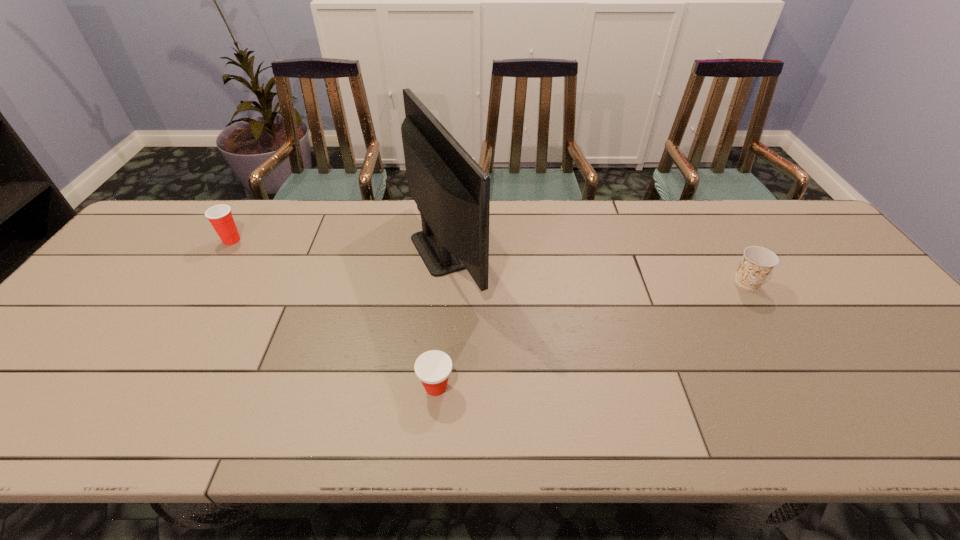
Where is `vacant space that satisfies the following two spatial constraints: 1. on the front-facing side of the computer monitor; 2. on the right side of the shortest Dixie cup`? The image size is (960, 540). vacant space that satisfies the following two spatial constraints: 1. on the front-facing side of the computer monitor; 2. on the right side of the shortest Dixie cup is located at coordinates (436, 387).

Where is `free space that satisfies the following two spatial constraints: 1. on the front-facing side of the computer monitor; 2. on the right side of the shortest Dixie cup`? The height and width of the screenshot is (540, 960). free space that satisfies the following two spatial constraints: 1. on the front-facing side of the computer monitor; 2. on the right side of the shortest Dixie cup is located at coordinates (436, 387).

Identify the location of vacant region that satisfies the following two spatial constraints: 1. on the front-facing side of the second farthest Dixie cup; 2. on the left side of the tallest object. Image resolution: width=960 pixels, height=540 pixels. (444, 283).

Find the location of a particular element. The height and width of the screenshot is (540, 960). vacant space that satisfies the following two spatial constraints: 1. on the front-facing side of the tallest object; 2. on the back side of the shortest Dixie cup is located at coordinates (436, 387).

You are a GUI agent. You are given a task and a screenshot of the screen. Output one action in this format:
    pyautogui.click(x=<x>, y=<y>)
    Task: Click on the vacant position in the image that satisfies the following two spatial constraints: 1. on the back side of the shortest Dixie cup; 2. on the right side of the second farthest Dixie cup
    Image resolution: width=960 pixels, height=540 pixels.
    Given the screenshot: What is the action you would take?
    pyautogui.click(x=444, y=283)

Find the location of a particular element. Image resolution: width=960 pixels, height=540 pixels. vacant area in the image that satisfies the following two spatial constraints: 1. on the front side of the leftmost object; 2. on the right side of the rightmost object is located at coordinates (204, 283).

Identify the location of vacant area that satisfies the following two spatial constraints: 1. on the front-facing side of the computer monitor; 2. on the back side of the rightmost Dixie cup. (444, 283).

Where is `free location that satisfies the following two spatial constraints: 1. on the front-facing side of the nearest object; 2. on the right side of the computer monitor`? The image size is (960, 540). free location that satisfies the following two spatial constraints: 1. on the front-facing side of the nearest object; 2. on the right side of the computer monitor is located at coordinates (436, 387).